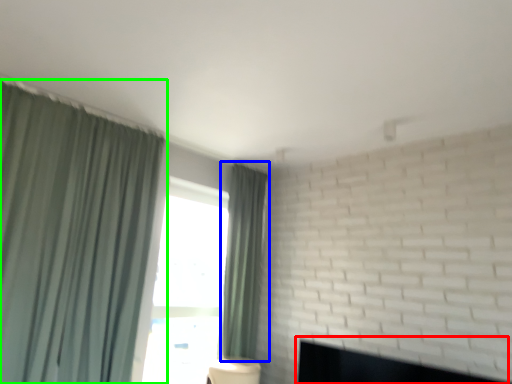
Question: Which object is the closest to the fireplace (highlighted by a red box)? Choose among these: curtain (highlighted by a blue box) or curtain (highlighted by a green box).

Choices:
 (A) curtain
 (B) curtain

Answer: (A)